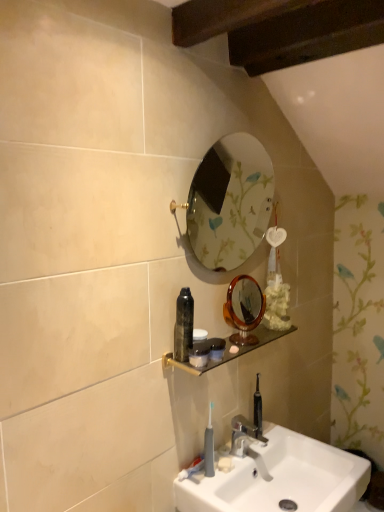
At what (x,y) coordinates should I click in order to perform the action: click on white ceramic sink at lower center. Please return your answer as a coordinate pair (x, y). The image size is (384, 512). Looking at the image, I should click on (280, 478).

You are a GUI agent. You are given a task and a screenshot of the screen. Output one action in this format:
    pyautogui.click(x=<x>, y=<y>)
    Task: Click on the white matte soap at lower center
    The width and height of the screenshot is (384, 512).
    Given the screenshot: What is the action you would take?
    pyautogui.click(x=225, y=463)

Measure the distance between point (213,355) and camera.

Point (213,355) is 4.33 feet away from camera.

The height and width of the screenshot is (512, 384). Describe the element at coordinates (183, 325) in the screenshot. I see `black glossy bottle at center, the 2th mouthwash positioned from the bottom` at that location.

Locate an element on the screen. The image size is (384, 512). black glossy bottle at center, which is counted as the 1th mouthwash, starting from the top is located at coordinates (183, 325).

The height and width of the screenshot is (512, 384). Identify the location of white ceramic sink at lower center. (280, 478).

Is translucent plastic container at center aimed at white matte soap at lower center?

No, translucent plastic container at center is not turned towards white matte soap at lower center.

Considering the points (214, 339) and (221, 469), which point is behind, point (214, 339) or point (221, 469)?

The point (214, 339) is farther from the camera.

Between translucent plastic container at center and white matte soap at lower center, which one has smaller size?

white matte soap at lower center is smaller.

From a real-world perspective, is translucent plastic container at center physically located above or below white matte soap at lower center?

In terms of real-world spatial position, translucent plastic container at center is above white matte soap at lower center.

Is translucent plastic jar at shelf, the 1th mouthwash from the bottom, with chrome metallic faucet at lower center?

They are not placed beside each other.

Considering the relative sizes of translucent plastic jar at shelf, the 1th mouthwash from the bottom, and chrome metallic faucet at lower center in the image provided, is translucent plastic jar at shelf, the 1th mouthwash from the bottom, thinner than chrome metallic faucet at lower center?

Indeed, translucent plastic jar at shelf, the 1th mouthwash from the bottom, has a lesser width compared to chrome metallic faucet at lower center.

From the image's perspective, which object appears higher, translucent plastic jar at shelf, the 2th mouthwash positioned from the top, or chrome metallic faucet at lower center?

translucent plastic jar at shelf, the 2th mouthwash positioned from the top, is shown above in the image.

Is translucent plastic jar at shelf, the 1th mouthwash from the bottom, facing towards chrome metallic faucet at lower center?

No, translucent plastic jar at shelf, the 1th mouthwash from the bottom, is not aimed at chrome metallic faucet at lower center.

Is amber glass mirror at center, which is counted as the second mirror, starting from the top, in front of translucent plastic jar at shelf, the 2th mouthwash positioned from the top?

No, amber glass mirror at center, which is counted as the second mirror, starting from the top, is further to the viewer.

Which of these two, amber glass mirror at center, which is counted as the second mirror, starting from the top, or translucent plastic jar at shelf, the 2th mouthwash positioned from the top, stands taller?

Standing taller between the two is amber glass mirror at center, which is counted as the second mirror, starting from the top.

From a real-world perspective, starting from the translucent plastic jar at shelf, the 1th mouthwash from the bottom, which mirror is the 1st one vertically above it? Please provide its 2D coordinates.

[(244, 309)]

Is white matte soap at lower center at the right side of amber glass mirror at center, which is counted as the second mirror, starting from the top?

No.

Does white matte soap at lower center touch amber glass mirror at center, which is counted as the second mirror, starting from the top?

They are not placed beside each other.

From the image's perspective, relative to amber glass mirror at center, which is counted as the second mirror, starting from the top, is white matte soap at lower center above or below?

Based on their image positions, white matte soap at lower center is located beneath amber glass mirror at center, which is counted as the second mirror, starting from the top.

Could you tell me if translucent plastic container at center is turned towards black glossy bottle at center, the 2th mouthwash positioned from the bottom?

No, translucent plastic container at center is not facing towards black glossy bottle at center, the 2th mouthwash positioned from the bottom.

Considering the sizes of objects translucent plastic container at center and black glossy bottle at center, which is counted as the 1th mouthwash, starting from the top, in the image provided, who is bigger, translucent plastic container at center or black glossy bottle at center, which is counted as the 1th mouthwash, starting from the top,?

black glossy bottle at center, which is counted as the 1th mouthwash, starting from the top, is bigger.

Where is `mouthwash above the translucent plastic container at center (from the image's perspective)`? The width and height of the screenshot is (384, 512). mouthwash above the translucent plastic container at center (from the image's perspective) is located at coordinates (183, 325).

Which is closer to the camera, (217,350) or (192,305)?

The point (217,350) is in front.

Can you confirm if gray plastic toothbrush at lower center is thinner than amber glass mirror at center, which is the 1th mirror from bottom to top?

Yes.

Which object is further away from the camera, gray plastic toothbrush at lower center or amber glass mirror at center, which is the 1th mirror from bottom to top?

amber glass mirror at center, which is the 1th mirror from bottom to top, is more distant.

From the picture: Can you tell me how much gray plastic toothbrush at lower center and amber glass mirror at center, which is counted as the second mirror, starting from the top, differ in facing direction?

The angle between the facing direction of gray plastic toothbrush at lower center and the facing direction of amber glass mirror at center, which is counted as the second mirror, starting from the top, is 62.1 degrees.

Which is correct: gold-framed mirror at upper center, marked as the first mirror in a top-to-bottom arrangement, is inside translucent plastic jar at shelf, the 2th mouthwash positioned from the top, or outside of it?

gold-framed mirror at upper center, marked as the first mirror in a top-to-bottom arrangement, is not enclosed by translucent plastic jar at shelf, the 2th mouthwash positioned from the top.

From a real-world perspective, between gold-framed mirror at upper center, which appears as the 2th mirror when ordered from the bottom, and translucent plastic jar at shelf, the 1th mouthwash from the bottom, who is vertically lower?

translucent plastic jar at shelf, the 1th mouthwash from the bottom, is physically lower.

From the picture: Can you confirm if gold-framed mirror at upper center, which appears as the 2th mirror when ordered from the bottom, is positioned to the right of translucent plastic jar at shelf, the 1th mouthwash from the bottom?

Yes.

In order to click on toiletry that is above the white matte soap at lower center (from a real-world perspective) in this screenshot , I will do `click(217, 348)`.

I want to click on tap below the translucent plastic jar at shelf, the 1th mouthwash from the bottom (from the image's perspective), so click(x=244, y=435).

Which object lies nearer to the anchor point gray plastic toothbrush at lower center, white ceramic sink at lower center or white matte soap at lower center?

white matte soap at lower center.

Which object lies nearer to the anchor point chrome metallic faucet at lower center, amber glass mirror at center, which is the 1th mirror from bottom to top, or white ceramic sink at lower center?

Based on the image, white ceramic sink at lower center appears to be nearer to chrome metallic faucet at lower center.

Which object lies further to the anchor point gold-framed mirror at upper center, which appears as the 2th mirror when ordered from the bottom, black glossy bottle at center, the 2th mouthwash positioned from the bottom, or translucent plastic jar at shelf, the 2th mouthwash positioned from the top?

translucent plastic jar at shelf, the 2th mouthwash positioned from the top, is positioned further to the anchor gold-framed mirror at upper center, which appears as the 2th mirror when ordered from the bottom.

When comparing their distances from gold-framed mirror at upper center, which appears as the 2th mirror when ordered from the bottom, does amber glass mirror at center, which is the 1th mirror from bottom to top, or chrome metallic faucet at lower center seem closer?

amber glass mirror at center, which is the 1th mirror from bottom to top, is positioned closer to the anchor gold-framed mirror at upper center, which appears as the 2th mirror when ordered from the bottom.

Which object lies further to the anchor point chrome metallic faucet at lower center, white ceramic sink at lower center or amber glass mirror at center, which is the 1th mirror from bottom to top?

Among the two, amber glass mirror at center, which is the 1th mirror from bottom to top, is located further to chrome metallic faucet at lower center.

Looking at the image, which one is located further to chrome metallic faucet at lower center, black glossy bottle at center, which is counted as the 1th mouthwash, starting from the top, or translucent plastic jar at shelf, the 1th mouthwash from the bottom?

Based on the image, black glossy bottle at center, which is counted as the 1th mouthwash, starting from the top, appears to be further to chrome metallic faucet at lower center.

From the image, which object appears to be farther from translucent plastic container at center, wooden shelf at center or chrome metallic faucet at lower center?

Based on the image, chrome metallic faucet at lower center appears to be further to translucent plastic container at center.

Looking at the image, which one is located further to amber glass mirror at center, which is the 1th mirror from bottom to top, translucent plastic jar at shelf, the 2th mouthwash positioned from the top, or chrome metallic faucet at lower center?

Based on the image, chrome metallic faucet at lower center appears to be further to amber glass mirror at center, which is the 1th mirror from bottom to top.

Where is `toiletry between wooden shelf at center and amber glass mirror at center, which is the 1th mirror from bottom to top, along the z-axis`? The width and height of the screenshot is (384, 512). toiletry between wooden shelf at center and amber glass mirror at center, which is the 1th mirror from bottom to top, along the z-axis is located at coordinates tap(217, 348).

Image resolution: width=384 pixels, height=512 pixels. Identify the location of tap that lies between amber glass mirror at center, which is the 1th mirror from bottom to top, and white matte soap at lower center from top to bottom. (244, 435).

At what (x,y) coordinates should I click in order to perform the action: click on toiletry between black glossy bottle at center, the 2th mouthwash positioned from the bottom, and chrome metallic faucet at lower center from top to bottom. Please return your answer as a coordinate pair (x, y). The image size is (384, 512). Looking at the image, I should click on (217, 348).

This screenshot has height=512, width=384. Find the location of `soap between translucent plastic container at center and white ceramic sink at lower center from top to bottom`. soap between translucent plastic container at center and white ceramic sink at lower center from top to bottom is located at coordinates (225, 463).